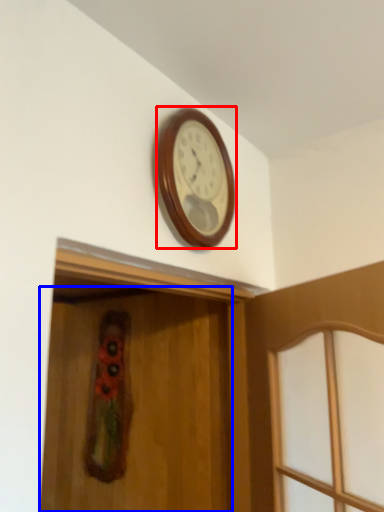
Question: Which object is further to the camera taking this photo, wall clock (highlighted by a red box) or screen door (highlighted by a blue box)?

Choices:
 (A) wall clock
 (B) screen door

Answer: (A)